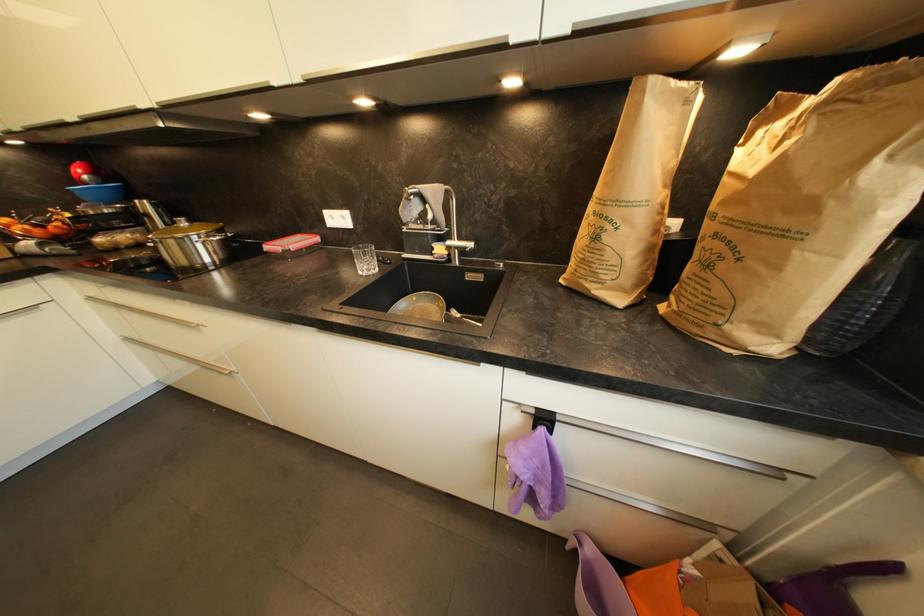
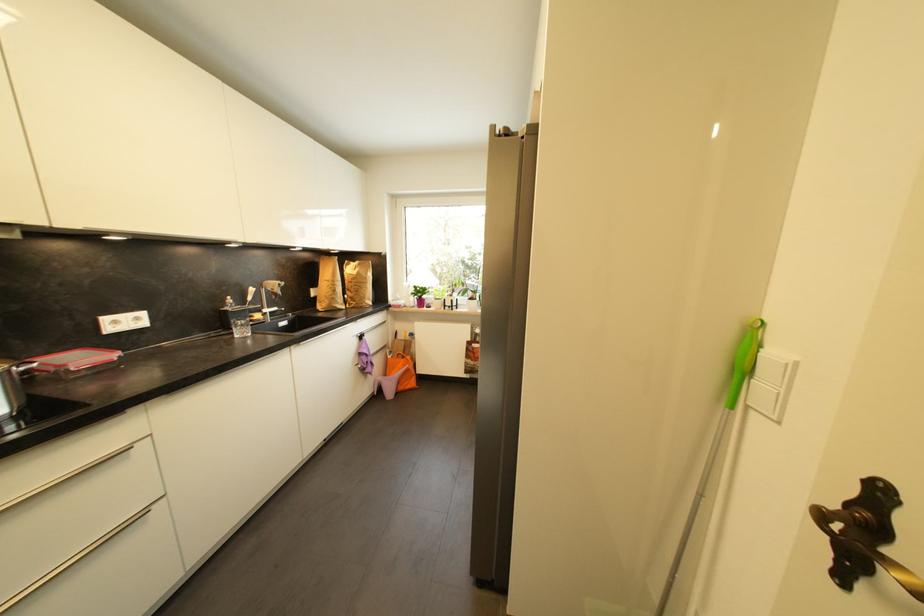
Locate, in the second image, the point that corresponds to point 730,204 in the first image.

(358, 281)